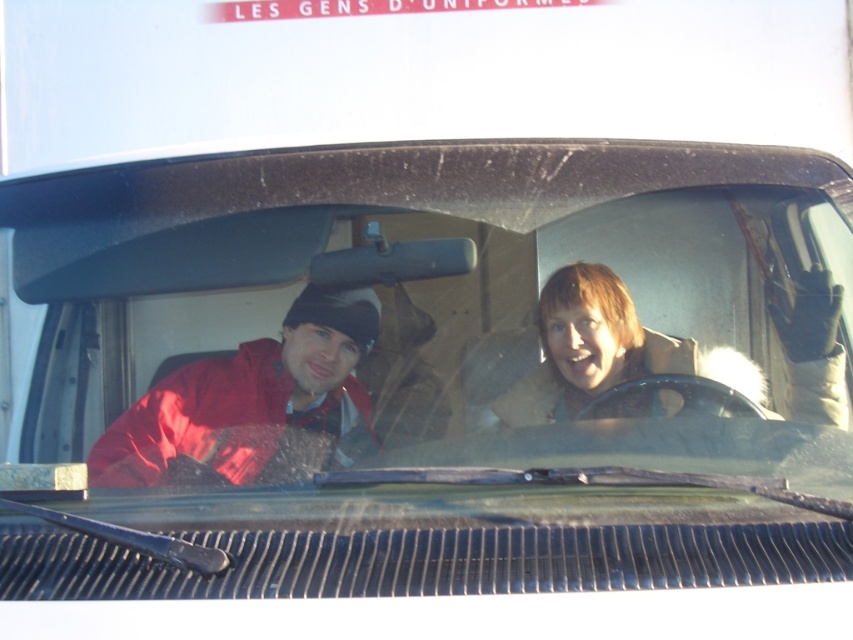
Which is below, transparent glass windshield at center or matte red jacket at left?

Positioned lower is matte red jacket at left.

Between transparent glass windshield at center and matte red jacket at left, which one has more height?

transparent glass windshield at center is taller.

Locate an element on the screen. This screenshot has width=853, height=640. transparent glass windshield at center is located at coordinates (491, 336).

Where is `transparent glass windshield at center`? Image resolution: width=853 pixels, height=640 pixels. transparent glass windshield at center is located at coordinates (491, 336).